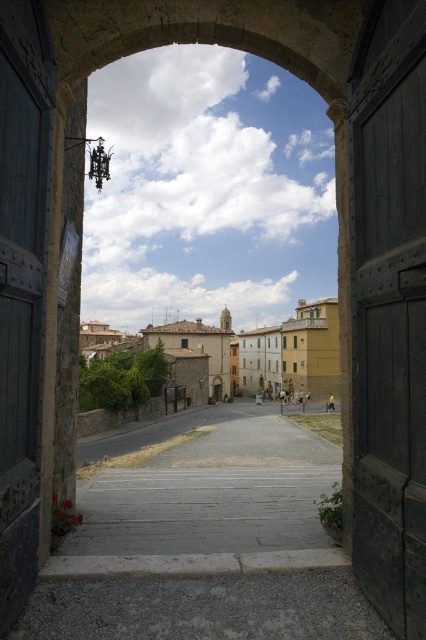
You are standing at the entrance of the village and see two points marked in the image. Which point is closer to you? The points are labeled as point (x=28, y=240) and point (x=94, y=352).

Point (x=28, y=240) is in front of point (x=94, y=352), so it is closer to you.

You are standing at the entrance of the village and looking through the arched stone gateway. There are two points marked on the cobblestone street ahead. The first point is at coordinate point [388,381] and the second is at point [307,340]. Which point is closer to you as you stand at the entrance?

Point [388,381] is closer to the viewer than point [307,340].